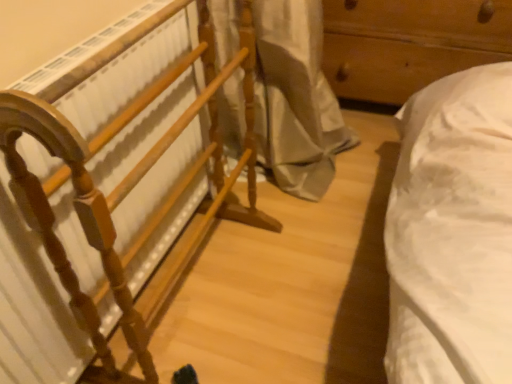
Find the location of a particular element. The image size is (512, 384). wooden drawer at right, which is the 2th furniture in left-to-right order is located at coordinates (409, 43).

What do you see at coordinates (409, 43) in the screenshot? I see `wooden drawer at right, which is the 2th furniture in left-to-right order` at bounding box center [409, 43].

What are the coordinates of `wooden rack at left, placed as the 1th furniture when sorted from front to back` in the screenshot? It's located at (128, 189).

What do you see at coordinates (128, 189) in the screenshot? This screenshot has height=384, width=512. I see `wooden rack at left, the 1th furniture when ordered from left to right` at bounding box center [128, 189].

Locate an element on the screen. The width and height of the screenshot is (512, 384). wooden drawer at right, the second furniture when ordered from front to back is located at coordinates (409, 43).

Considering the positions of objects wooden drawer at right, the second furniture when ordered from front to back, and wooden rack at left, the 1th furniture when ordered from left to right, in the image provided, who is more to the left, wooden drawer at right, the second furniture when ordered from front to back, or wooden rack at left, the 1th furniture when ordered from left to right,?

From the viewer's perspective, wooden rack at left, the 1th furniture when ordered from left to right, appears more on the left side.

Considering the positions of objects wooden drawer at right, which is counted as the first furniture, starting from the right, and wooden rack at left, placed as the 1th furniture when sorted from front to back, in the image provided, who is behind, wooden drawer at right, which is counted as the first furniture, starting from the right, or wooden rack at left, placed as the 1th furniture when sorted from front to back,?

wooden drawer at right, which is counted as the first furniture, starting from the right, is further away from the camera.

Considering the positions of point (505, 15) and point (113, 381), is point (505, 15) closer or farther from the camera than point (113, 381)?

Point (505, 15) is positioned farther from the camera compared to point (113, 381).

From the image's perspective, which is below, wooden drawer at right, the second furniture when ordered from front to back, or wooden rack at left, the second furniture from the right?

wooden rack at left, the second furniture from the right, from the image's perspective.

From a real-world perspective, is wooden drawer at right, the second furniture when ordered from front to back, beneath wooden rack at left, the second furniture from the right?

Yes.

Is wooden drawer at right, positioned as the first furniture in back-to-front order, wider or thinner than wooden rack at left, the 1th furniture when ordered from left to right?

Clearly, wooden drawer at right, positioned as the first furniture in back-to-front order, has more width compared to wooden rack at left, the 1th furniture when ordered from left to right.

Can you confirm if wooden drawer at right, which is the 2th furniture in left-to-right order, is shorter than wooden rack at left, placed as the 1th furniture when sorted from front to back?

Correct, wooden drawer at right, which is the 2th furniture in left-to-right order, is not as tall as wooden rack at left, placed as the 1th furniture when sorted from front to back.

Does wooden drawer at right, positioned as the first furniture in back-to-front order, have a smaller size compared to wooden rack at left, which is counted as the 2th furniture, starting from the back?

Actually, wooden drawer at right, positioned as the first furniture in back-to-front order, might be larger than wooden rack at left, which is counted as the 2th furniture, starting from the back.

Is wooden drawer at right, which is counted as the first furniture, starting from the right, not within wooden rack at left, placed as the 1th furniture when sorted from front to back?

wooden drawer at right, which is counted as the first furniture, starting from the right, lies outside wooden rack at left, placed as the 1th furniture when sorted from front to back,'s area.

Is wooden drawer at right, the second furniture when ordered from front to back, far from wooden rack at left, which is counted as the 2th furniture, starting from the back?

No, wooden drawer at right, the second furniture when ordered from front to back, is not far from wooden rack at left, which is counted as the 2th furniture, starting from the back.

Is wooden drawer at right, the second furniture when ordered from front to back, facing towards wooden rack at left, placed as the 1th furniture when sorted from front to back?

Yes, wooden drawer at right, the second furniture when ordered from front to back, faces towards wooden rack at left, placed as the 1th furniture when sorted from front to back.

This screenshot has height=384, width=512. In order to click on furniture on the left of the wooden drawer at right, which is the 2th furniture in left-to-right order in this screenshot , I will do `click(128, 189)`.

From the picture: Is wooden rack at left, the second furniture from the right, at the right side of wooden drawer at right, positioned as the first furniture in back-to-front order?

In fact, wooden rack at left, the second furniture from the right, is to the left of wooden drawer at right, positioned as the first furniture in back-to-front order.

Does wooden rack at left, placed as the 1th furniture when sorted from front to back, come behind wooden drawer at right, which is counted as the first furniture, starting from the right?

No, the depth of wooden rack at left, placed as the 1th furniture when sorted from front to back, is less than that of wooden drawer at right, which is counted as the first furniture, starting from the right.

Which point is more distant from viewer, (68, 279) or (339, 81)?

Positioned behind is point (339, 81).

From the image's perspective, does wooden rack at left, the second furniture from the right, appear higher than wooden drawer at right, positioned as the first furniture in back-to-front order?

Incorrect, from the image's perspective, wooden rack at left, the second furniture from the right, is lower than wooden drawer at right, positioned as the first furniture in back-to-front order.

Based on the photo, from a real-world perspective, is wooden rack at left, the 1th furniture when ordered from left to right, physically above wooden drawer at right, which is the 2th furniture in left-to-right order?

Yes, from a real-world perspective, wooden rack at left, the 1th furniture when ordered from left to right, is above wooden drawer at right, which is the 2th furniture in left-to-right order.

In terms of width, does wooden rack at left, which is counted as the 2th furniture, starting from the back, look wider or thinner when compared to wooden drawer at right, which is counted as the first furniture, starting from the right?

Considering their sizes, wooden rack at left, which is counted as the 2th furniture, starting from the back, looks slimmer than wooden drawer at right, which is counted as the first furniture, starting from the right.

Can you confirm if wooden rack at left, the 1th furniture when ordered from left to right, is taller than wooden drawer at right, the second furniture when ordered from front to back?

Yes.

Between wooden rack at left, placed as the 1th furniture when sorted from front to back, and wooden drawer at right, positioned as the first furniture in back-to-front order, which one has larger size?

With larger size is wooden drawer at right, positioned as the first furniture in back-to-front order.

Can we say wooden rack at left, which is counted as the 2th furniture, starting from the back, lies outside wooden drawer at right, which is counted as the first furniture, starting from the right?

Absolutely, wooden rack at left, which is counted as the 2th furniture, starting from the back, is external to wooden drawer at right, which is counted as the first furniture, starting from the right.

Are wooden rack at left, which is counted as the 2th furniture, starting from the back, and wooden drawer at right, which is counted as the first furniture, starting from the right, making contact?

No, wooden rack at left, which is counted as the 2th furniture, starting from the back, is not with wooden drawer at right, which is counted as the first furniture, starting from the right.

Could you tell me if wooden rack at left, the 1th furniture when ordered from left to right, is turned towards wooden drawer at right, which is the 2th furniture in left-to-right order?

No, wooden rack at left, the 1th furniture when ordered from left to right, is not aimed at wooden drawer at right, which is the 2th furniture in left-to-right order.

Find the location of a particular element. Image resolution: width=512 pixels, height=384 pixels. furniture behind the wooden rack at left, the second furniture from the right is located at coordinates (409, 43).

Locate an element on the screen. furniture that is under the wooden rack at left, the second furniture from the right (from a real-world perspective) is located at coordinates (409, 43).

Where is `furniture that is above the wooden drawer at right, which is the 2th furniture in left-to-right order (from a real-world perspective)`? This screenshot has height=384, width=512. furniture that is above the wooden drawer at right, which is the 2th furniture in left-to-right order (from a real-world perspective) is located at coordinates (128, 189).